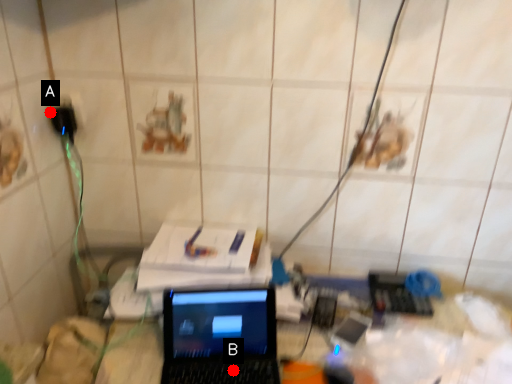
Question: Two points are circled on the image, labeled by A and B beside each circle. Which point is farther to the camera?

Choices:
 (A) A is further
 (B) B is further

Answer: (A)